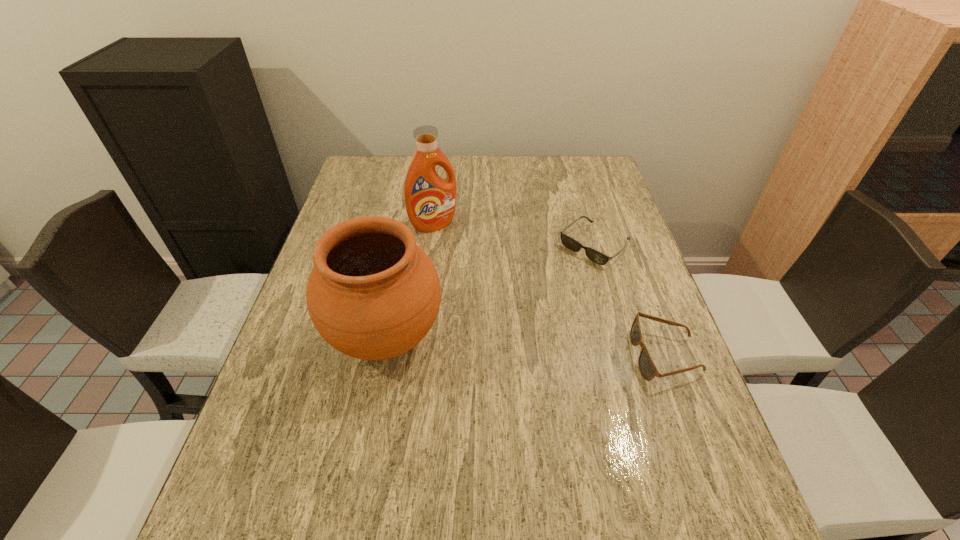
Locate an element on the screen. free space between the taller sunglasses and the pottery is located at coordinates (526, 347).

The width and height of the screenshot is (960, 540). I want to click on free spot between the detergent and the taller sunglasses, so [x=550, y=290].

Find the location of a particular element. object that ranks as the closest to the shortest object is located at coordinates (648, 370).

Locate an element on the screen. The image size is (960, 540). object that is the closest to the farther sunglasses is located at coordinates (648, 370).

Where is `free space that satisfies the following two spatial constraints: 1. on the front side of the farther sunglasses; 2. on the frames of the taller sunglasses`? free space that satisfies the following two spatial constraints: 1. on the front side of the farther sunglasses; 2. on the frames of the taller sunglasses is located at coordinates (626, 355).

Where is `vacant space that satisfies the following two spatial constraints: 1. on the front side of the taller sunglasses; 2. on the frames of the pottery`? vacant space that satisfies the following two spatial constraints: 1. on the front side of the taller sunglasses; 2. on the frames of the pottery is located at coordinates (382, 355).

At what (x,y) coordinates should I click in order to perform the action: click on blank space that satisfies the following two spatial constraints: 1. on the back side of the shorter sunglasses; 2. on the left side of the pottery. Please return your answer as a coordinate pair (x, y). The height and width of the screenshot is (540, 960). Looking at the image, I should click on pyautogui.click(x=403, y=245).

At what (x,y) coordinates should I click in order to perform the action: click on vacant space that satisfies the following two spatial constraints: 1. on the back side of the detergent; 2. on the left side of the pottery. Please return your answer as a coordinate pair (x, y). The height and width of the screenshot is (540, 960). Looking at the image, I should click on (407, 225).

Find the location of a particular element. free spot that satisfies the following two spatial constraints: 1. on the front side of the detergent; 2. on the frames of the taller sunglasses is located at coordinates (418, 355).

I want to click on vacant space that satisfies the following two spatial constraints: 1. on the front side of the taller sunglasses; 2. on the frames of the shorter sunglasses, so click(x=626, y=355).